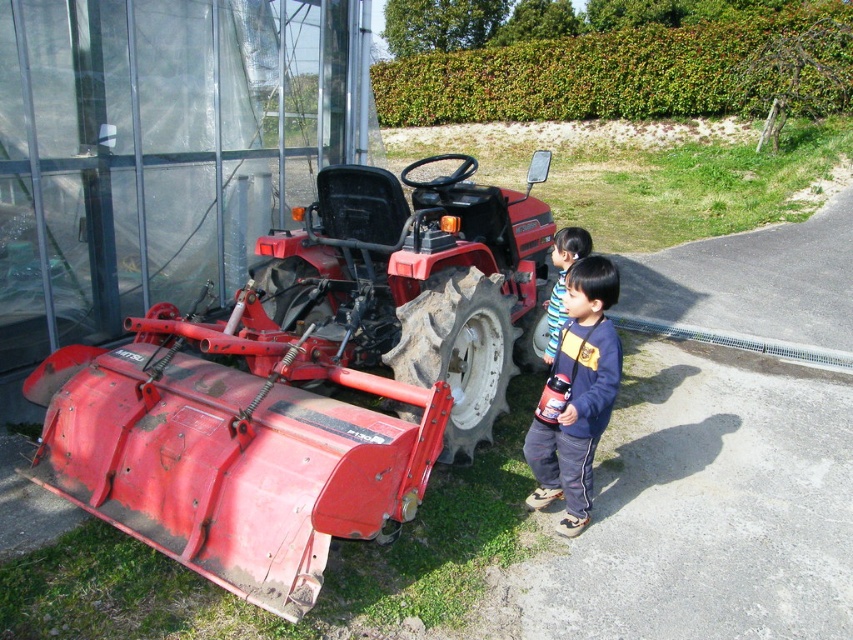
You are standing in the field where the red tractor is parked. You need to locate the blue cotton shirt at lower right. Where exactly should you look?

You should look at point (x=576, y=396) to find the blue cotton shirt at lower right.

You are a photographer trying to capture a photo of the striped shirt at center and the blue cotton shirt at lower right. Since you want both subjects to be in the frame, which direction should you move the camera to include both?

The blue cotton shirt at lower right is to the left of the striped shirt at center, so you should move the camera to the left to include both the blue cotton shirt at lower right and the striped shirt at center in the frame.

You are a farmer who needs to move the glossy plastic bottle at lower right to a storage area. The storage area is located behind the red matte tractor at center. Can you move the bottle without moving the tractor first?

The red matte tractor at center is larger in size than the glossy plastic bottle at lower right, so yes, you can move the glossy plastic bottle at lower right to the storage area behind the tractor without needing to move the tractor first.